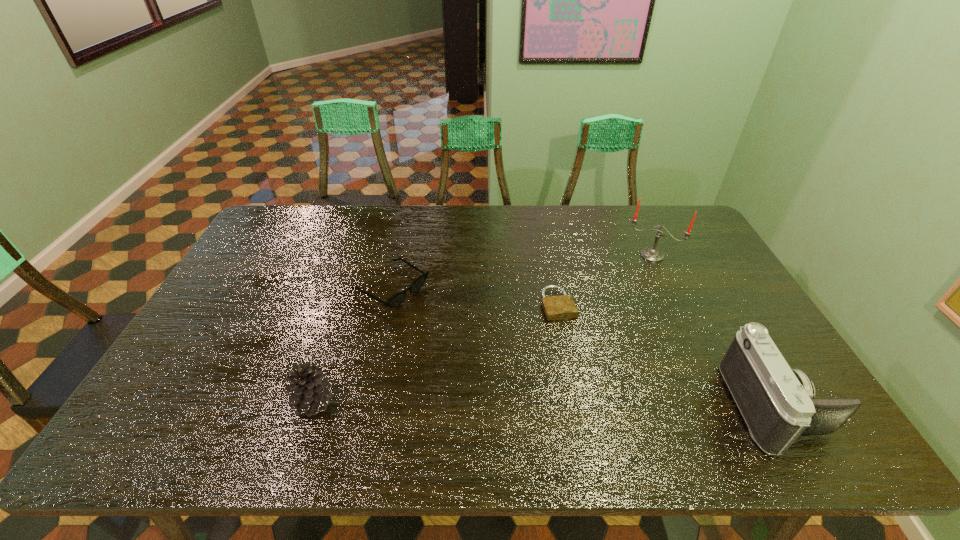
Identify the location of the third shortest object. (309, 388).

I want to click on camera, so click(777, 403).

This screenshot has height=540, width=960. Identify the location of candle. (652, 254).

The height and width of the screenshot is (540, 960). I want to click on the shortest object, so click(561, 307).

Identify the location of the third object from right to left. The image size is (960, 540). (561, 307).

Image resolution: width=960 pixels, height=540 pixels. What are the coordinates of `sunglasses` in the screenshot? It's located at (397, 299).

This screenshot has height=540, width=960. I want to click on free space located on the right of the third shortest object, so click(x=464, y=402).

Identify the location of vacant space located on the front-facing side of the candle. The height and width of the screenshot is (540, 960). (631, 310).

Locate an element on the screen. vacant region located on the front-facing side of the candle is located at coordinates (628, 321).

This screenshot has height=540, width=960. In order to click on free spot located 0.090m on the front-facing side of the candle in this screenshot , I will do `click(640, 279)`.